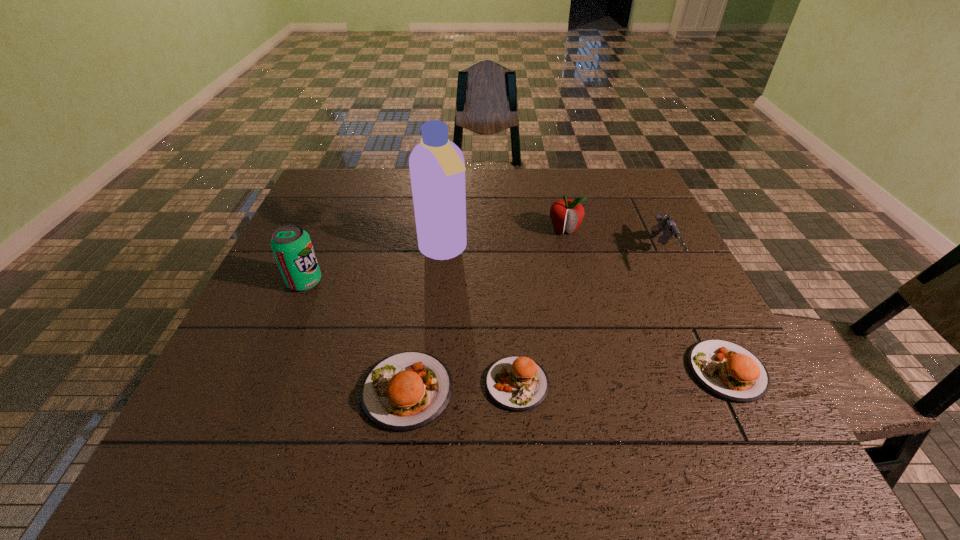
The image size is (960, 540). What are the coordinates of `object that is at the near right corner` in the screenshot? It's located at (728, 370).

The image size is (960, 540). In the image, there is a desktop. Identify the location of vacant area at the far edge. (498, 193).

Identify the location of vacant region at the left edge of the desktop. (335, 233).

At what (x,y) coordinates should I click in order to perform the action: click on vacant position at the right edge of the desktop. Please return your answer as a coordinate pair (x, y). The width and height of the screenshot is (960, 540). Looking at the image, I should click on [x=645, y=218].

You are a GUI agent. You are given a task and a screenshot of the screen. Output one action in this format:
    pyautogui.click(x=<x>, y=<y>)
    Task: Click on the free space at the far right corner of the desktop
    The height and width of the screenshot is (540, 960).
    Given the screenshot: What is the action you would take?
    pyautogui.click(x=629, y=195)

Locate an element on the screen. unoccupied area between the pop soda and the tallest object is located at coordinates (374, 266).

Find the location of a particular element. free point between the leftmost patty and the apple is located at coordinates (486, 310).

Where is `empty location between the leftmost patty and the rightmost patty`? This screenshot has height=540, width=960. empty location between the leftmost patty and the rightmost patty is located at coordinates (567, 381).

The height and width of the screenshot is (540, 960). In order to click on free space between the tallest object and the third object from right to left in this screenshot , I will do `click(504, 240)`.

Where is `vacant space that is in between the gun and the tallest object`? The image size is (960, 540). vacant space that is in between the gun and the tallest object is located at coordinates (553, 253).